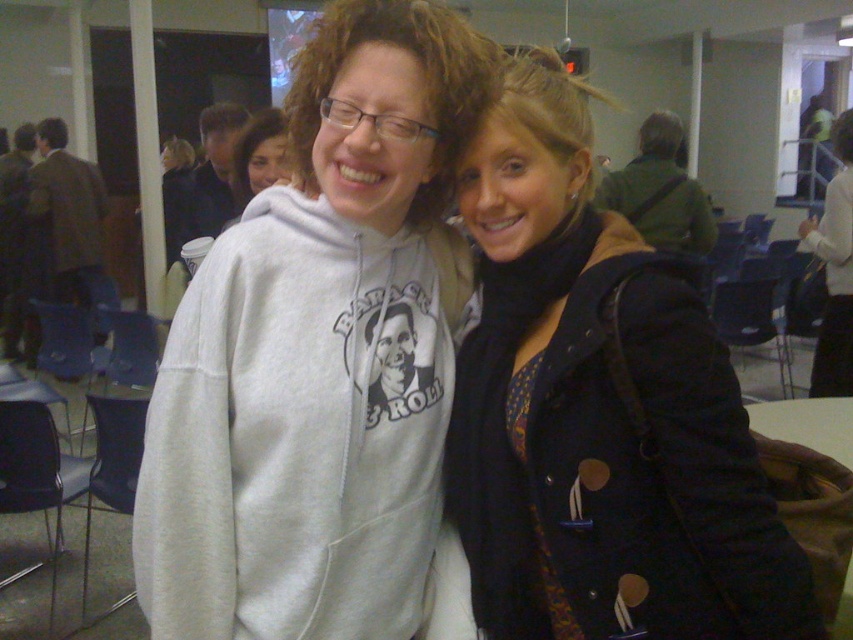
Question: Where is gray sweatshirt at center located in relation to dark blue textured coat at center in the image?

Choices:
 (A) below
 (B) above

Answer: (B)

Question: Which of the following is the farthest from the observer?

Choices:
 (A) (387, 404)
 (B) (752, 632)

Answer: (A)

Question: Is gray sweatshirt at center thinner than dark blue textured coat at center?

Choices:
 (A) no
 (B) yes

Answer: (A)

Question: Which point appears closest to the camera in this image?

Choices:
 (A) (384, 202)
 (B) (570, 292)

Answer: (A)

Question: Is gray sweatshirt at center smaller than dark blue textured coat at center?

Choices:
 (A) yes
 (B) no

Answer: (B)